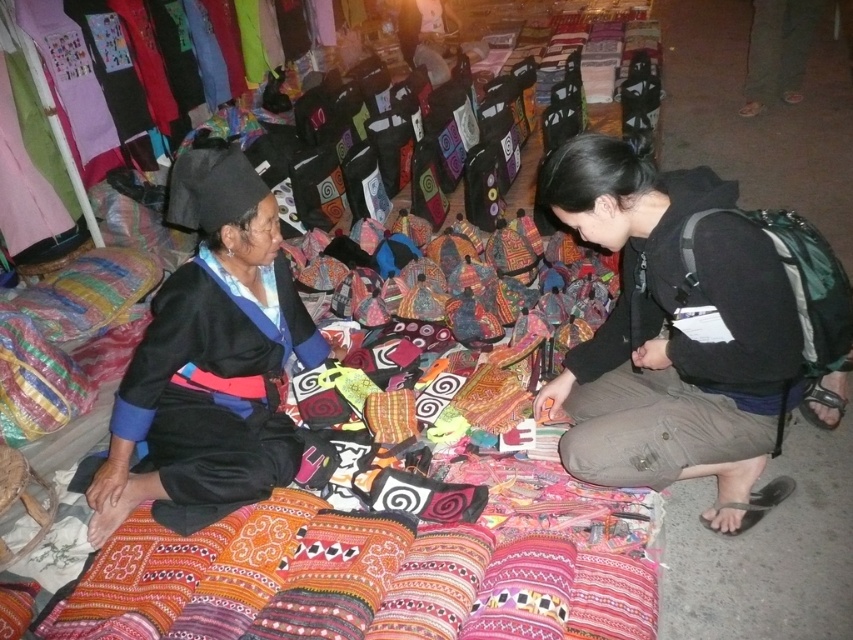
Who is lower down, black cotton pants at lower right or black matte dress at left?

black cotton pants at lower right is below.

Which is in front, point (680, 209) or point (227, 227)?

Point (680, 209) is more forward.

Image resolution: width=853 pixels, height=640 pixels. Find the location of `black cotton pants at lower right`. black cotton pants at lower right is located at coordinates (672, 333).